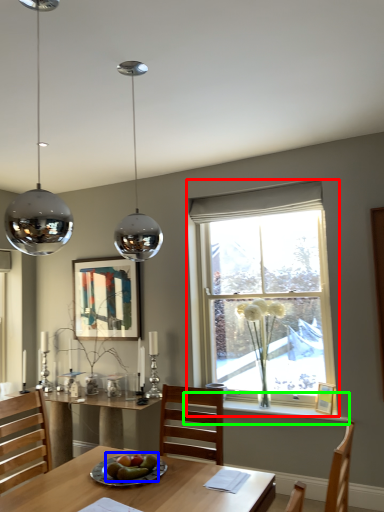
Question: Considering the real-world distances, which object is farthest from window (highlighted by a red box)? food (highlighted by a blue box) or window sill (highlighted by a green box)?

Choices:
 (A) food
 (B) window sill

Answer: (A)